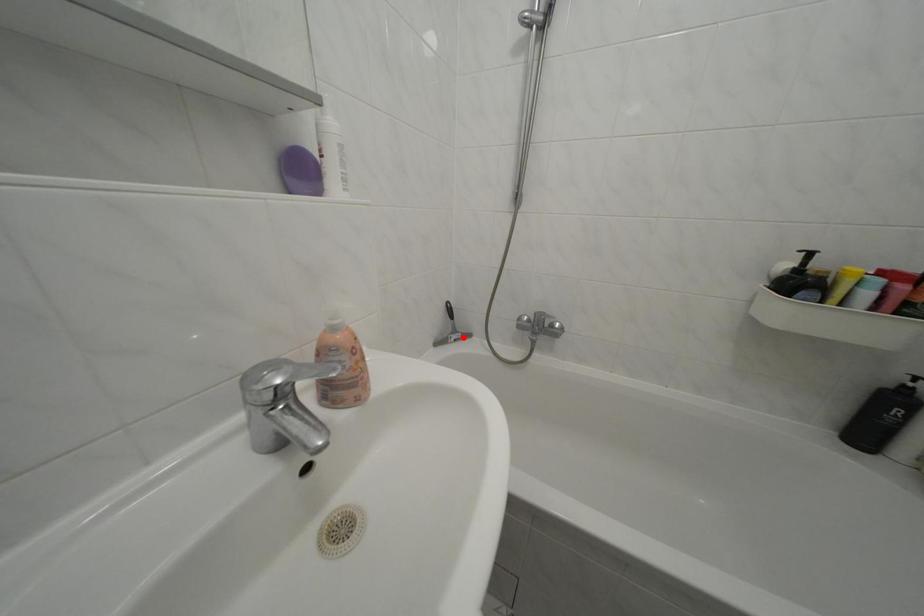
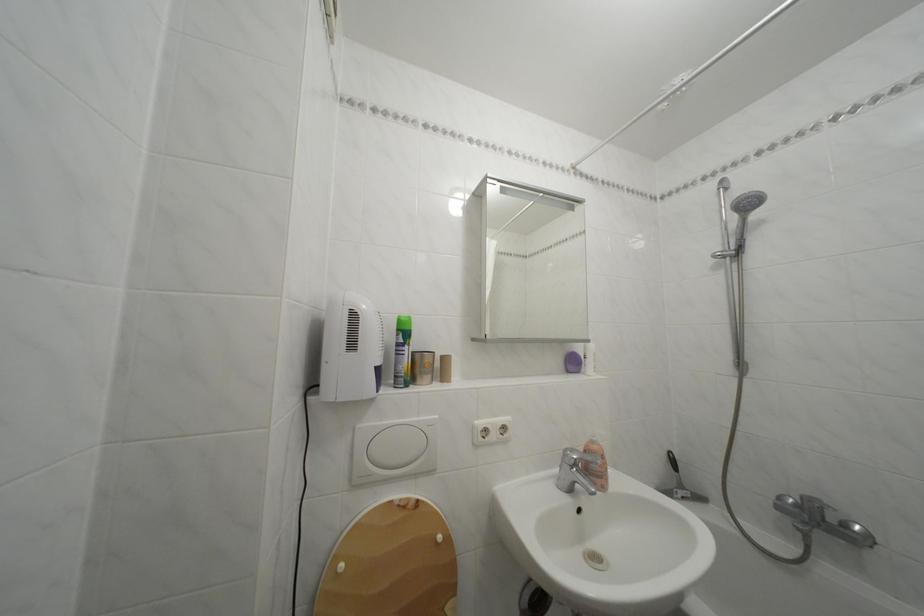
The point at the highlighted location is marked in the first image. Where is the corresponding point in the second image?

(689, 492)